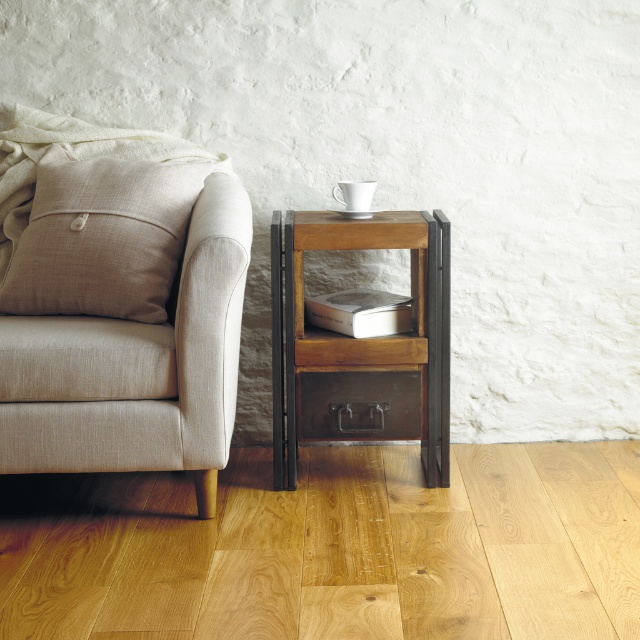
Question: Among these objects, which one is nearest to the camera?

Choices:
 (A) woodenmaterial/texturetable at right
 (B) metallic drawer at lower center

Answer: (A)

Question: Is beige fabric couch at left to the left of beige linen pillow at left from the viewer's perspective?

Choices:
 (A) yes
 (B) no

Answer: (A)

Question: Is woodenmaterial/texturetable at right above beige linen pillow at left?

Choices:
 (A) no
 (B) yes

Answer: (A)

Question: Can you confirm if beige linen pillow at left is positioned to the right of metallic drawer at lower center?

Choices:
 (A) no
 (B) yes

Answer: (A)

Question: Which object appears closest to the camera in this image?

Choices:
 (A) woodenmaterial/texturetable at right
 (B) beige fabric couch at left
 (C) beige linen pillow at left
 (D) metallic drawer at lower center

Answer: (B)

Question: Which of the following is the farthest from the observer?

Choices:
 (A) metallic drawer at lower center
 (B) beige linen pillow at left

Answer: (A)